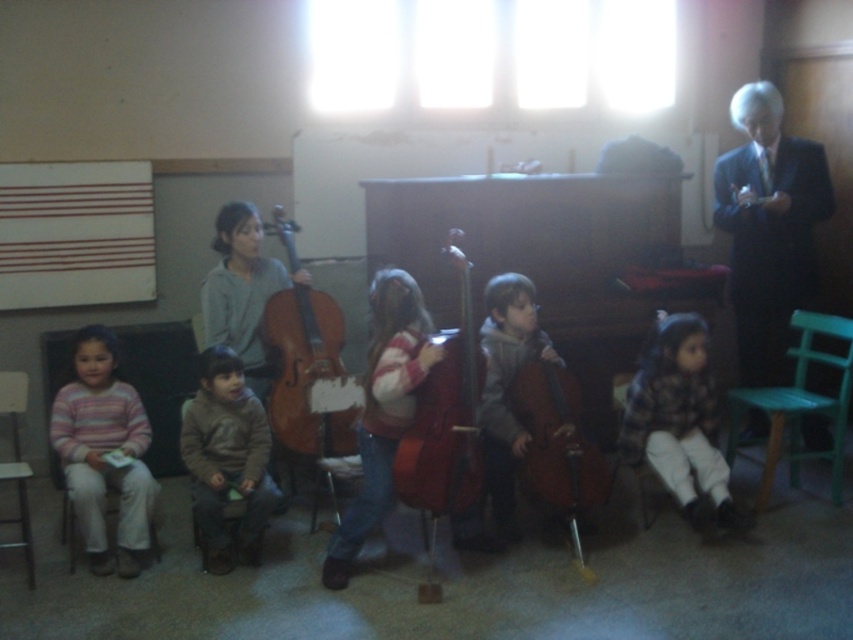
Which of these two, striped sweater at left or green plastic chair at lower right, stands shorter?

With less height is green plastic chair at lower right.

Between striped sweater at left and green plastic chair at lower right, which one appears on the right side from the viewer's perspective?

From the viewer's perspective, green plastic chair at lower right appears more on the right side.

Image resolution: width=853 pixels, height=640 pixels. What do you see at coordinates (103, 452) in the screenshot? I see `striped sweater at left` at bounding box center [103, 452].

This screenshot has height=640, width=853. In order to click on striped sweater at left in this screenshot , I will do `click(103, 452)`.

How much distance is there between gray wool sweater at center and brown matte cello at center?

gray wool sweater at center is 5.90 inches away from brown matte cello at center.

Does gray wool sweater at center appear on the right side of brown matte cello at center?

No, gray wool sweater at center is not to the right of brown matte cello at center.

You are a GUI agent. You are given a task and a screenshot of the screen. Output one action in this format:
    pyautogui.click(x=<x>, y=<y>)
    Task: Click on the gray wool sweater at center
    
    Given the screenshot: What is the action you would take?
    pyautogui.click(x=506, y=387)

From the picture: Can you confirm if dark suit at right is smaller than striped sweater at left?

Incorrect, dark suit at right is not smaller in size than striped sweater at left.

Does point (746, 244) lie in front of point (97, 525)?

No.

You are a GUI agent. You are given a task and a screenshot of the screen. Output one action in this format:
    pyautogui.click(x=<x>, y=<y>)
    Task: Click on the dark suit at right
    
    Given the screenshot: What is the action you would take?
    pyautogui.click(x=769, y=228)